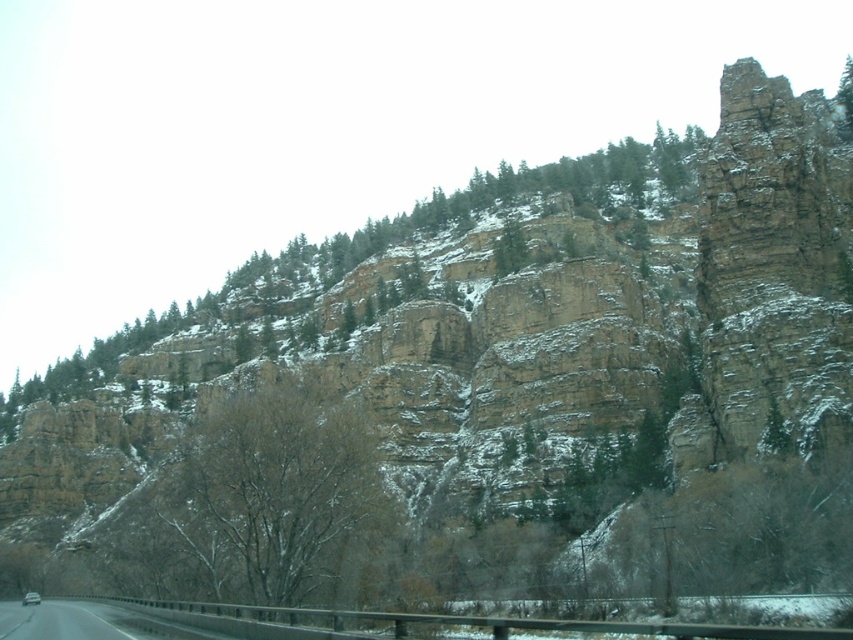
Is bare branches at center thinner than green textured tree at upper right?

Yes, bare branches at center is thinner than green textured tree at upper right.

Is bare branches at center to the right of green textured tree at upper right from the viewer's perspective?

Incorrect, bare branches at center is not on the right side of green textured tree at upper right.

Between point (357, 461) and point (846, 84), which one is positioned in front?

Point (357, 461) is more forward.

This screenshot has height=640, width=853. I want to click on bare branches at center, so click(x=271, y=492).